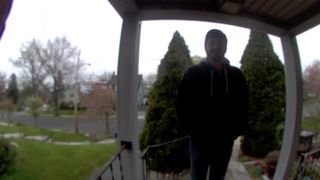
The width and height of the screenshot is (320, 180). Identify the location of house pillar. (123, 86), (295, 89).